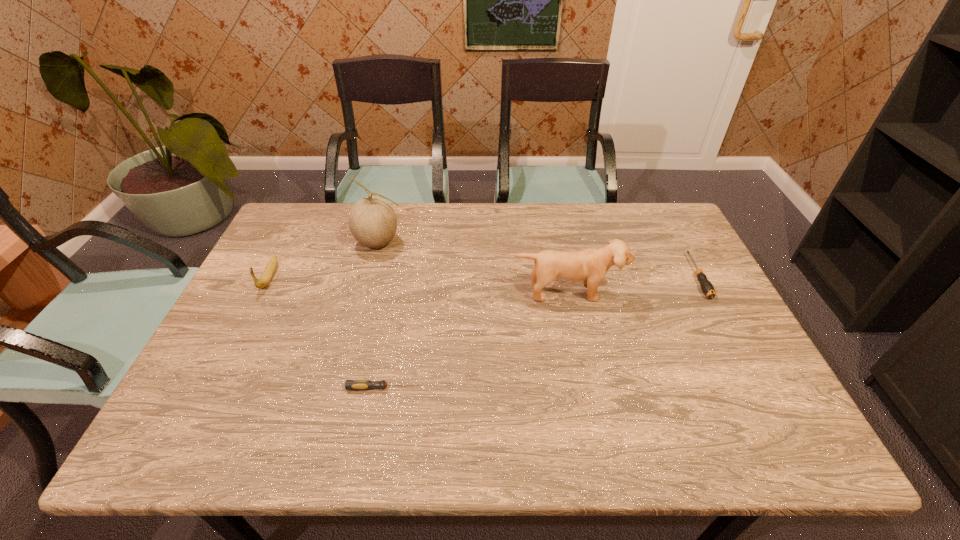
Locate an element on the screen. object that ranks as the closest to the cantaloup is located at coordinates (267, 275).

The image size is (960, 540). I want to click on blank space that satisfies the following two spatial constraints: 1. on the left side of the second object from right to left; 2. insert the nearest object into a screw head, so click(x=585, y=388).

Identify the location of free space that satisfies the following two spatial constraints: 1. on the front side of the right screwdriver; 2. insert the shortest object into a screw head. (756, 388).